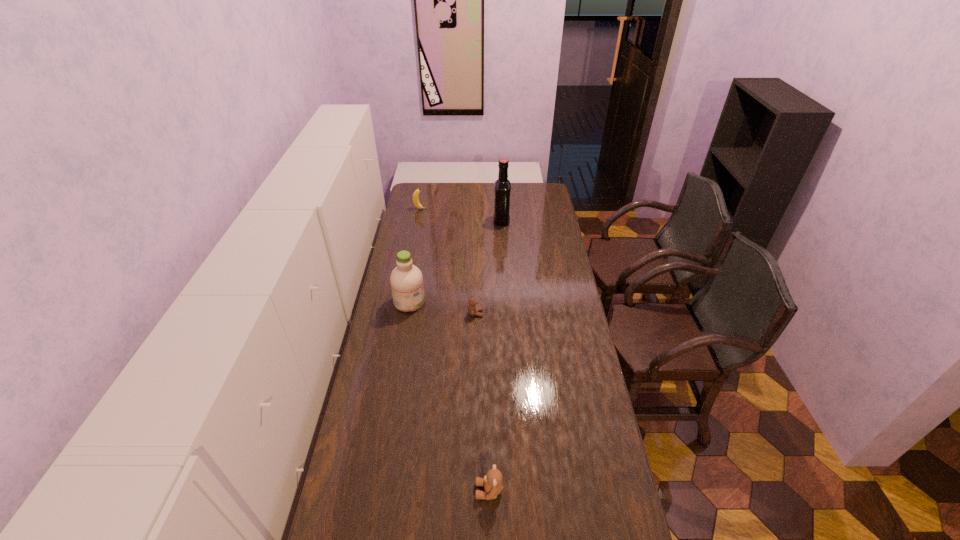
Find the location of a particular element. This screenshot has height=540, width=960. empty location between the liquor and the nearest object is located at coordinates (495, 356).

At what (x,y) coordinates should I click in order to perform the action: click on free spot between the nearer teddy bear and the rightmost object. Please return your answer as a coordinate pair (x, y). This screenshot has width=960, height=540. Looking at the image, I should click on (495, 356).

Identify the location of the closest object to the shorter teddy bear. point(406,280).

Image resolution: width=960 pixels, height=540 pixels. In order to click on the fourth closest object to the shortest object in this screenshot , I will do `click(416, 202)`.